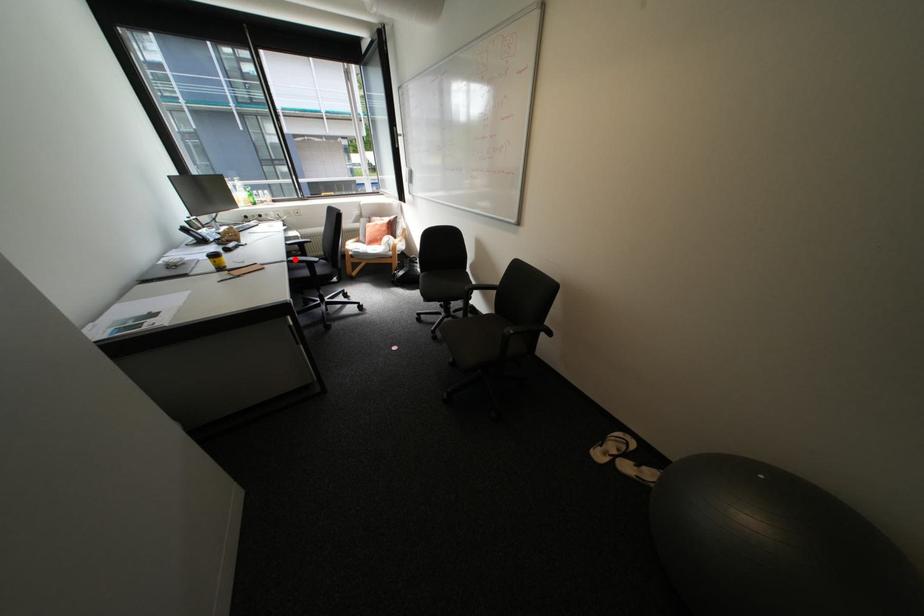
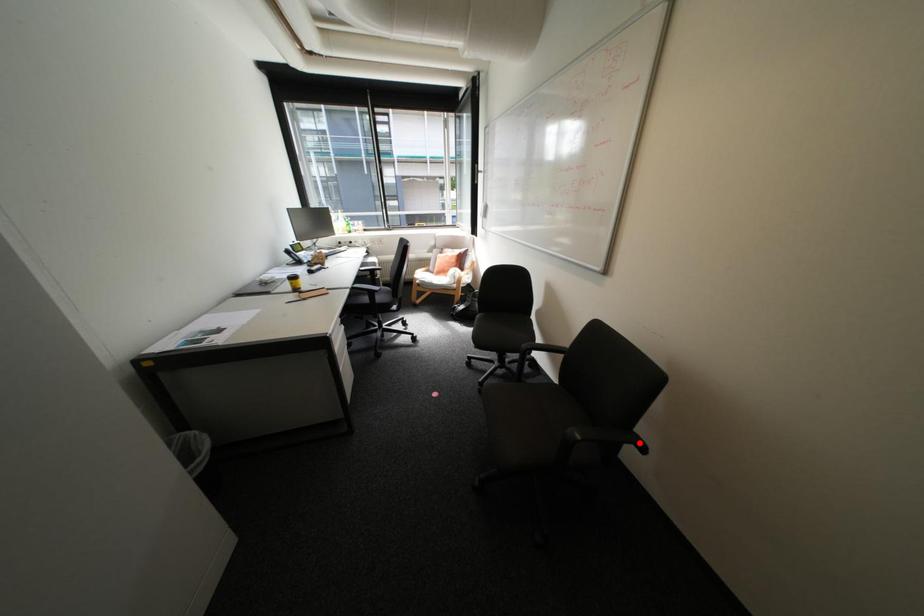
I am providing you with two images of the same scene from different viewpoints. A red point is marked on the first image and another point is marked on the second image. Does the point marked in image1 correspond to the same location as the one in image2?

No